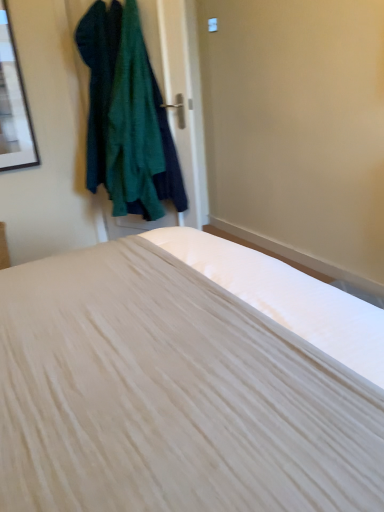
Question: From a real-world perspective, is dark green textured sweater at upper left, which ranks as the second clothing in left-to-right order, physically located above or below matte black picture frame at upper left?

Choices:
 (A) below
 (B) above

Answer: (A)

Question: In terms of width, does dark green textured sweater at upper left, which ranks as the second clothing in left-to-right order, look wider or thinner when compared to matte black picture frame at upper left?

Choices:
 (A) thin
 (B) wide

Answer: (B)

Question: Considering the real-world distances, which object is closest to the dark green textured sweater at upper left, which ranks as the second clothing in left-to-right order?

Choices:
 (A) dark green textured sweater at upper left, which ranks as the first clothing in left-to-right order
 (B) matte black picture frame at upper left
 (C) white matte bed at center

Answer: (A)

Question: Estimate the real-world distances between objects in this image. Which object is farther from the matte black picture frame at upper left?

Choices:
 (A) dark green textured sweater at upper left, which ranks as the first clothing in left-to-right order
 (B) dark green textured sweater at upper left, which ranks as the second clothing in left-to-right order
 (C) white matte bed at center

Answer: (C)